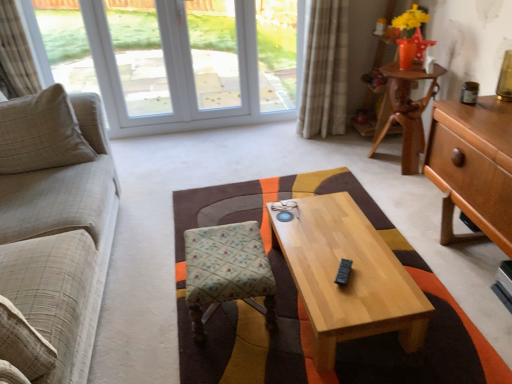
This screenshot has width=512, height=384. I want to click on empty space that is ontop of patterned fabric stool at center (from a real-world perspective), so click(x=225, y=251).